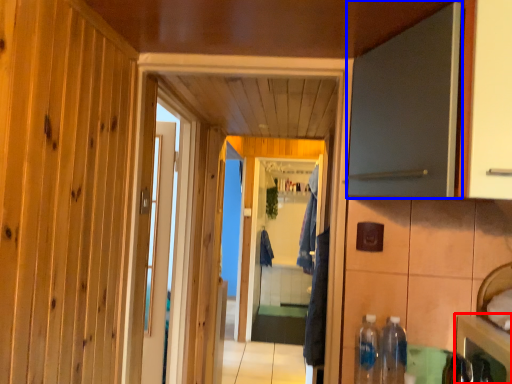
Question: Which object is further to the camera taking this photo, cabinetry (highlighted by a red box) or door (highlighted by a blue box)?

Choices:
 (A) cabinetry
 (B) door

Answer: (A)